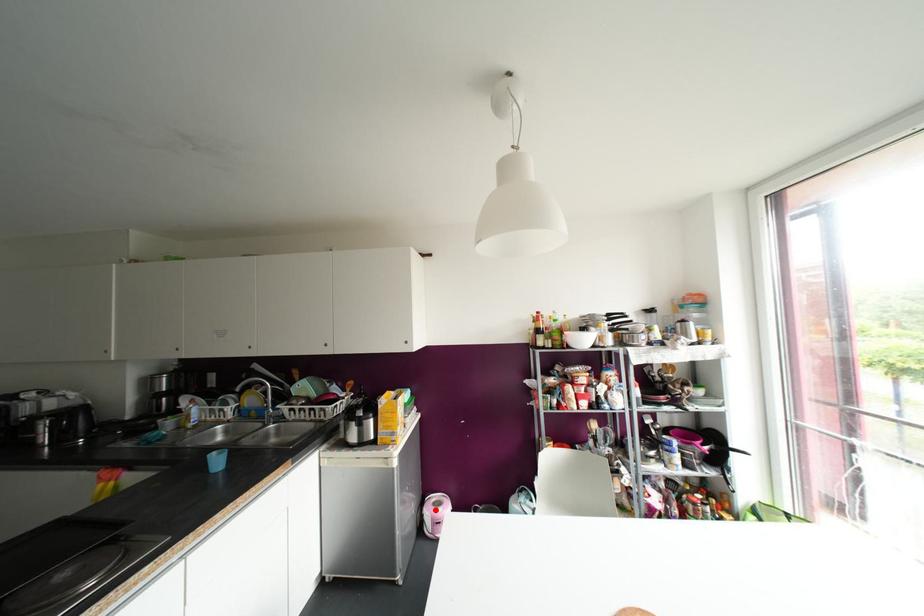
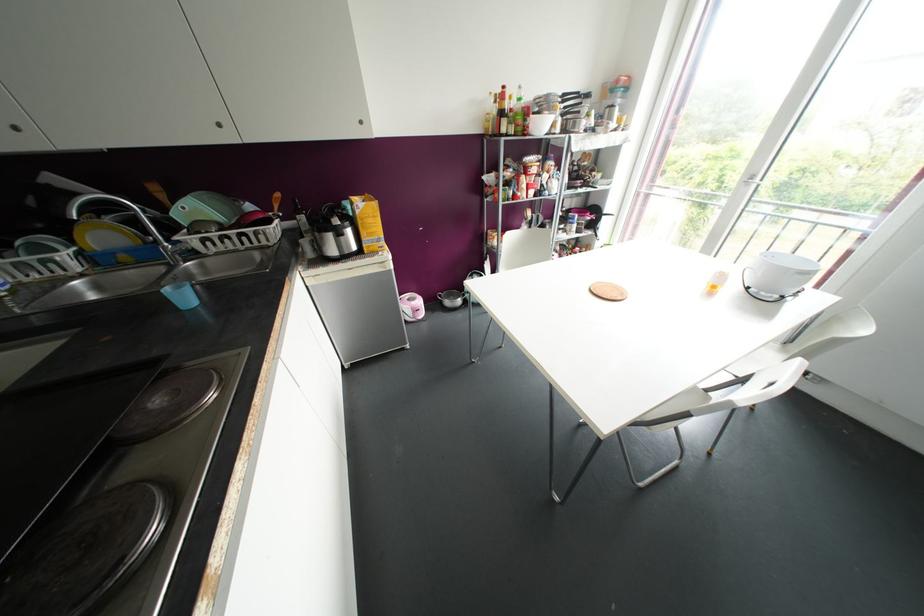
Where in the second image is the point corresponding to the highlighted location from the first image?

(412, 302)